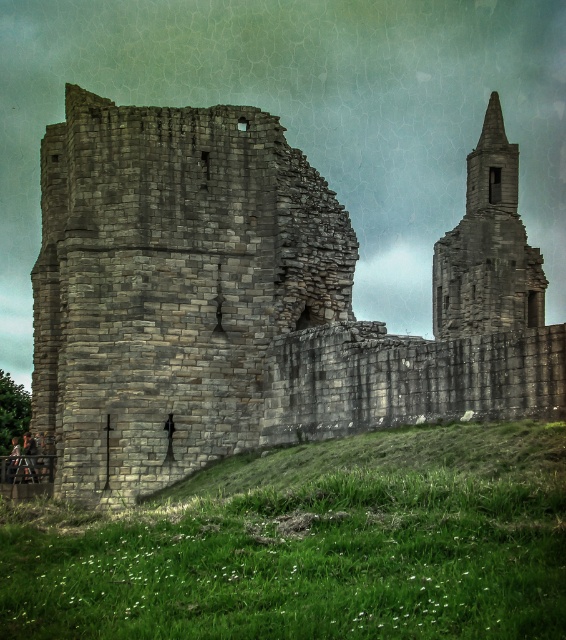
You are standing in the ruins of a medieval stone structure. You want to locate the gray stone castle at left. According to the coordinates provided, where exactly would you find it?

The gray stone castle at left is located at point (x=254, y=300).